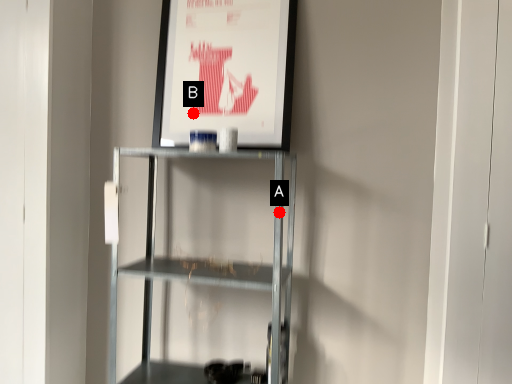
Question: Two points are circled on the image, labeled by A and B beside each circle. Which point is closer to the camera?

Choices:
 (A) A is closer
 (B) B is closer

Answer: (A)